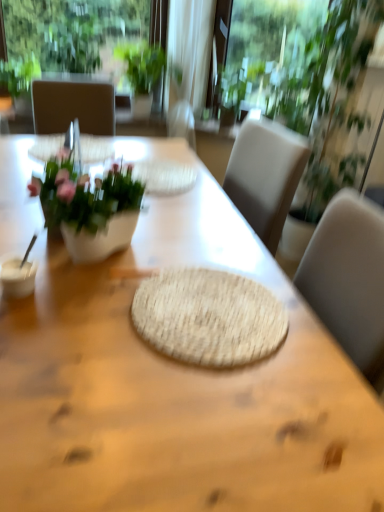
Question: Is point (349, 38) positioned closer to the camera than point (114, 25)?

Choices:
 (A) closer
 (B) farther

Answer: (A)

Question: From the image's perspective, is green leafy plant at upper right, positioned as the 1th houseplant in right-to-left order, located above or below transparent glass window at upper center?

Choices:
 (A) below
 (B) above

Answer: (A)

Question: Which is nearer to the white glossy vase at left?

Choices:
 (A) natural woven placemat at center
 (B) green leafy plant at upper center, which is the second houseplant from right to left
 (C) transparent glass window at upper center
 (D) natural woven mat at center
 (E) transparent glass window screen at upper center

Answer: (A)

Question: Estimate the real-world distances between objects in this image. Which object is closer to the white glossy vase at left?

Choices:
 (A) natural woven placemat at center
 (B) green leafy plant at upper left, arranged as the first houseplant when viewed from the left
 (C) natural woven mat at center
 (D) green leafy plant at upper right, positioned as the 1th houseplant in right-to-left order
 (E) green leafy plant at upper center, acting as the second houseplant starting from the left

Answer: (A)